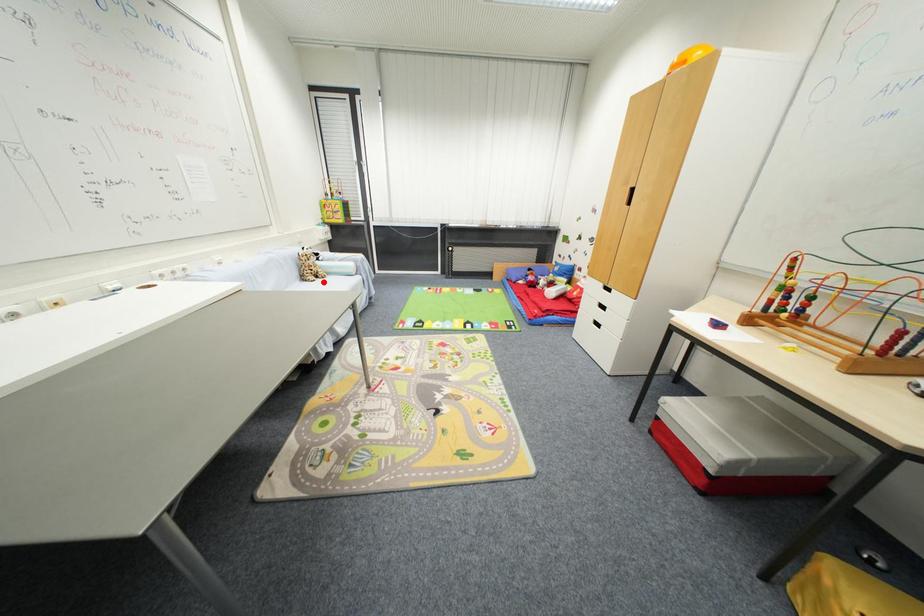
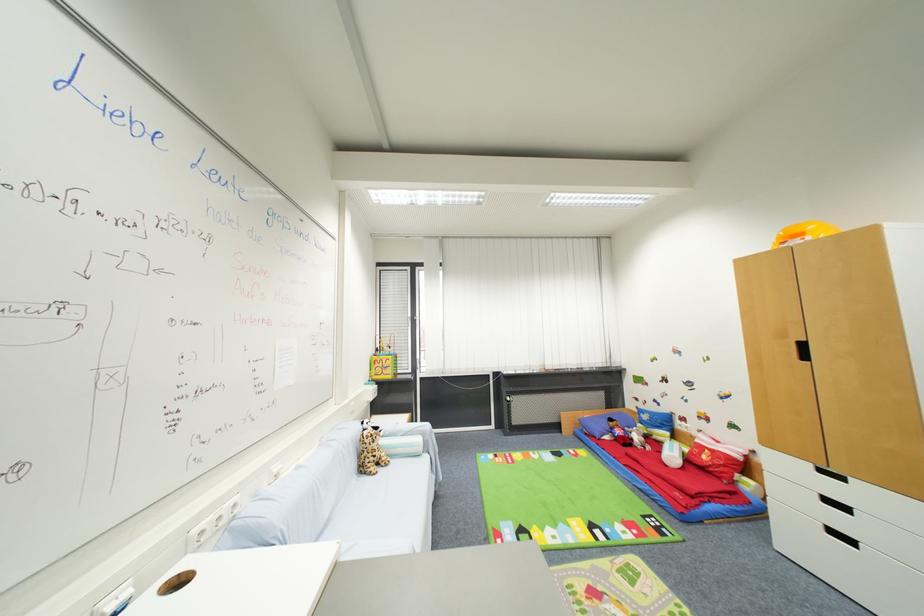
The point at the highlighted location is marked in the first image. Where is the corresponding point in the second image?

(385, 472)